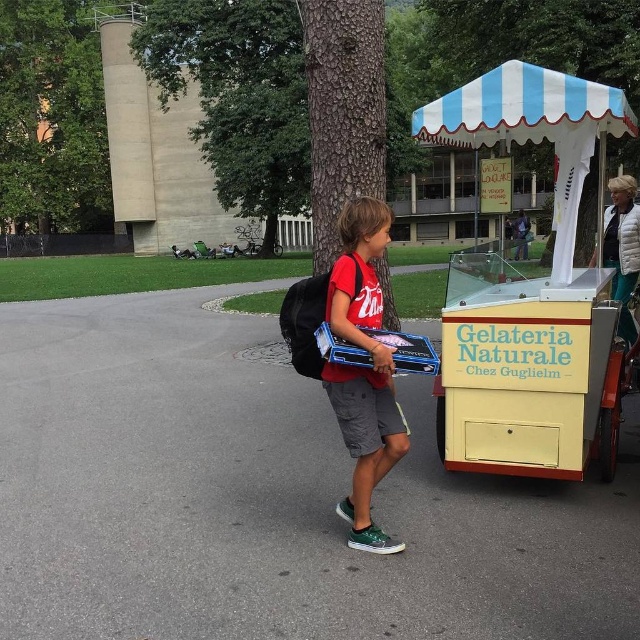
Between point (582, 113) and point (605, 237), which one is positioned behind?

Positioned behind is point (605, 237).

I want to click on blue and white striped canopy at upper right, so click(532, 129).

Between point (387, 371) and point (621, 192), which one is positioned behind?

Positioned behind is point (621, 192).

Does matte red t-shirt at center have a lesser height compared to white fabric umbrella at upper right?

In fact, matte red t-shirt at center may be taller than white fabric umbrella at upper right.

The image size is (640, 640). I want to click on matte red t-shirt at center, so click(x=364, y=371).

Is point (468, 104) more distant than point (346, 403)?

Yes, it is behind point (346, 403).

Does blue and white striped canopy at upper right appear over matte red t-shirt at center?

Yes.

Which is in front, point (470, 86) or point (385, 445)?

Point (385, 445) is more forward.

The height and width of the screenshot is (640, 640). Find the location of `blue and white striped canopy at upper right`. blue and white striped canopy at upper right is located at coordinates (532, 129).